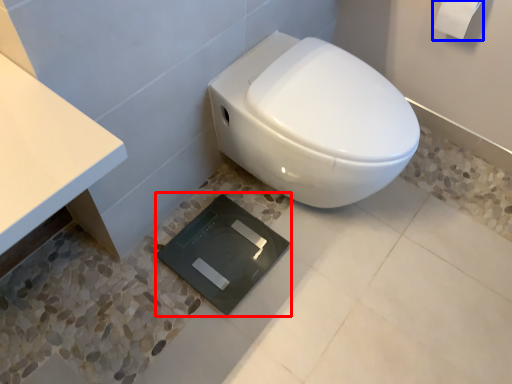
Question: Which object is further to the camera taking this photo, pad (highlighted by a red box) or toilet paper (highlighted by a blue box)?

Choices:
 (A) pad
 (B) toilet paper

Answer: (A)